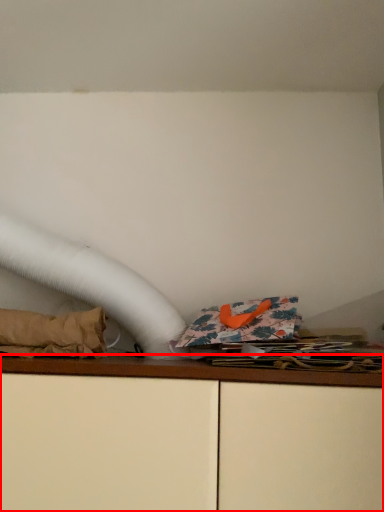
Question: From the image, what is the correct spatial relationship of furniture (annotated by the red box) in relation to material?

Choices:
 (A) left
 (B) right

Answer: (B)